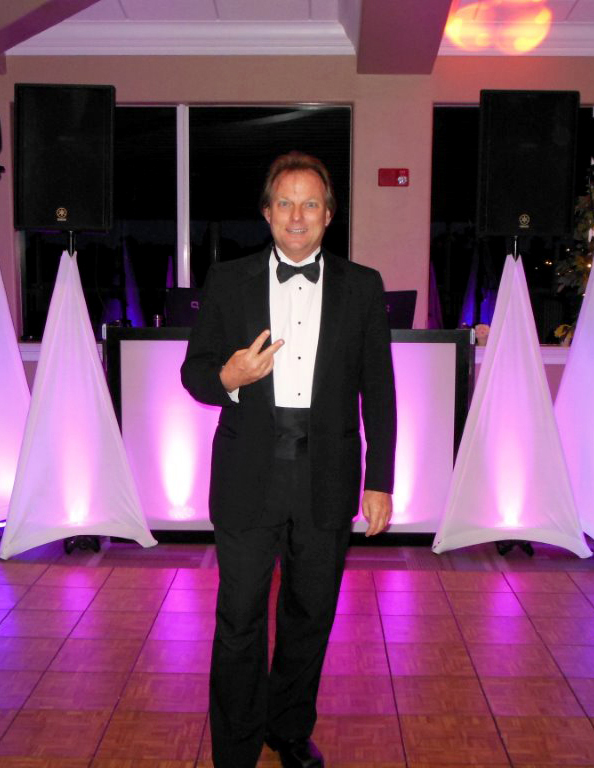
Where is `triangular tent lights`? triangular tent lights is located at coordinates (518, 487), (74, 487), (583, 415), (18, 415).